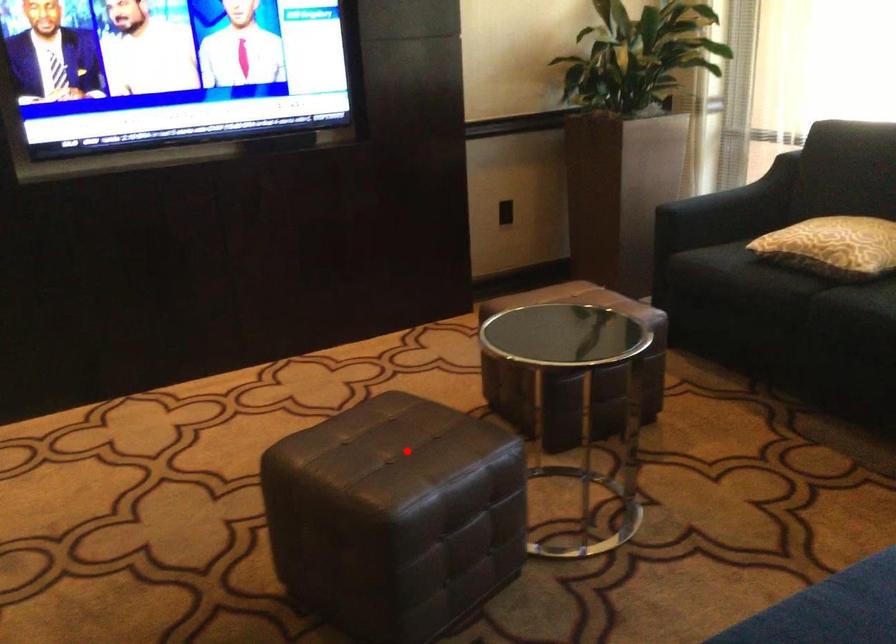
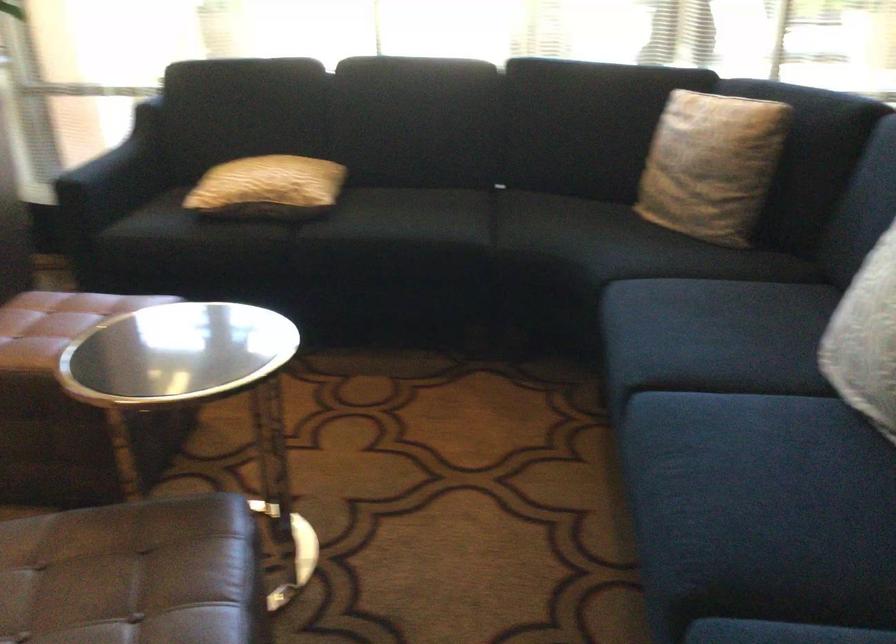
In the second image, find the point that corresponds to the highlighted location in the first image.

(134, 574)